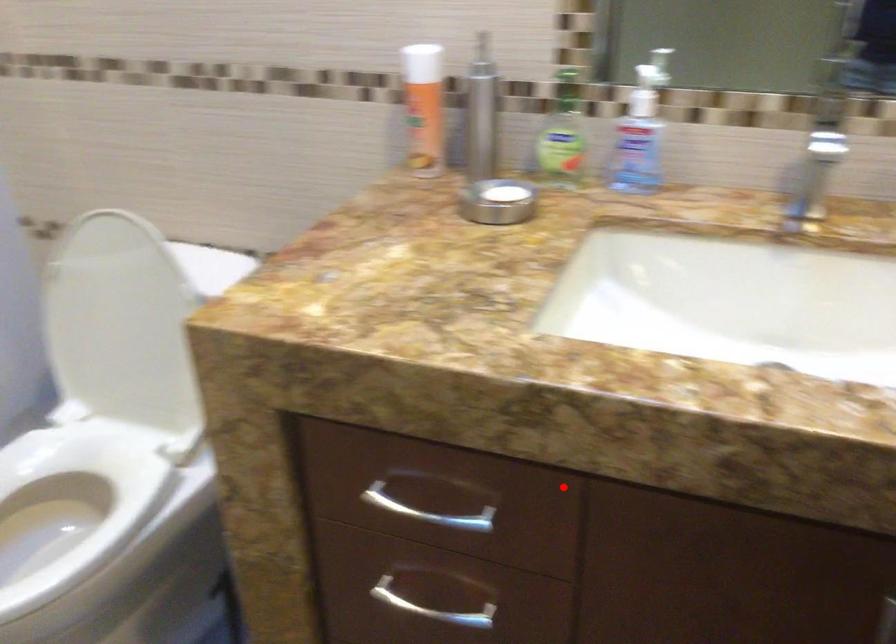
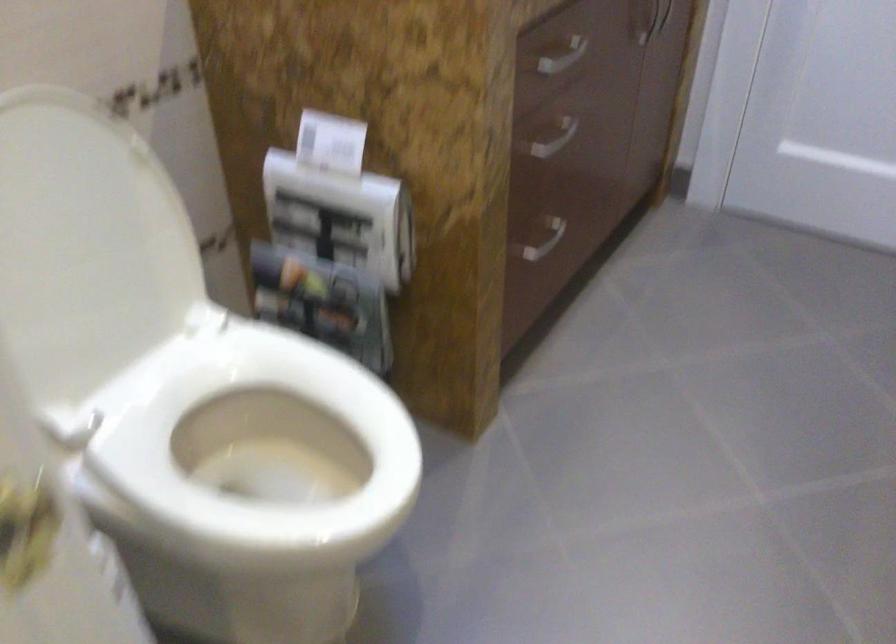
Question: A red point is marked in image1. In image2, is the corresponding 3D point closer to the camera or farther? Reply with the corresponding letter.

Choices:
 (A) The corresponding 3D point is closer.
 (B) The corresponding 3D point is farther.

Answer: (B)